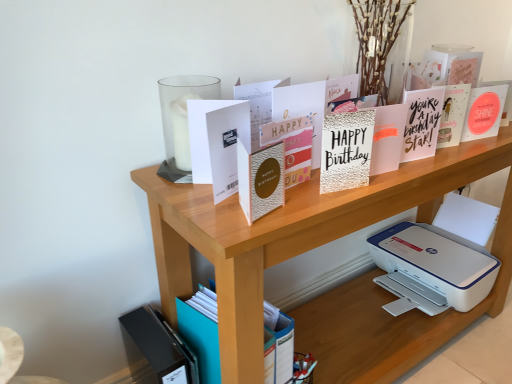
In order to click on free space in front of gold textured card at center, the 4th paperback book in the left-to-right sequence in this screenshot , I will do `click(284, 218)`.